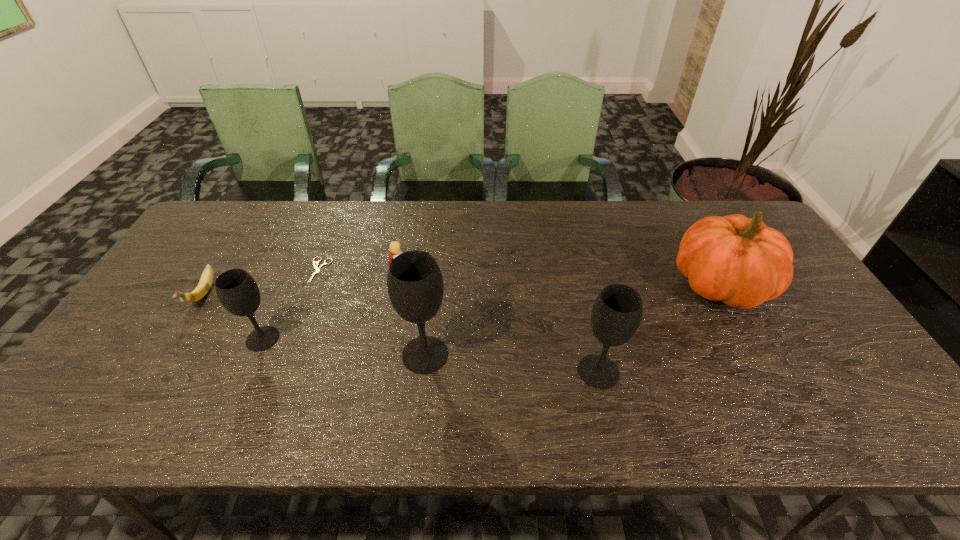
You are a GUI agent. You are given a task and a screenshot of the screen. Output one action in this format:
    pyautogui.click(x=<x>, y=<y>)
    Task: Click on the object located at the right edge
    
    Given the screenshot: What is the action you would take?
    pyautogui.click(x=740, y=261)

This screenshot has width=960, height=540. In the image, there is a desktop. Find the location of `vacant region at the far edge`. vacant region at the far edge is located at coordinates (546, 217).

This screenshot has height=540, width=960. Find the location of `free space at the near edge of the desktop`. free space at the near edge of the desktop is located at coordinates 776,384.

Find the location of `blank space at the far left corner`. blank space at the far left corner is located at coordinates 217,236.

In the image, there is a desktop. Identify the location of vacant area at the far right corner. The image size is (960, 540). (741, 208).

Where is `vacant area that lies between the second shortest object and the fifth object from right to left`? This screenshot has width=960, height=540. vacant area that lies between the second shortest object and the fifth object from right to left is located at coordinates (261, 283).

At what (x,y) coordinates should I click in order to perform the action: click on free area in between the rightmost wineglass and the third object from right to left. Please return your answer as a coordinate pair (x, y). Looking at the image, I should click on (512, 363).

The height and width of the screenshot is (540, 960). I want to click on free spot between the leftmost wineglass and the rightmost object, so click(x=492, y=313).

This screenshot has height=540, width=960. Find the location of `free space between the shortest object and the pumpkin`. free space between the shortest object and the pumpkin is located at coordinates (519, 278).

This screenshot has height=540, width=960. Identify the location of vacant point located between the second object from left to right and the third object from right to left. (344, 347).